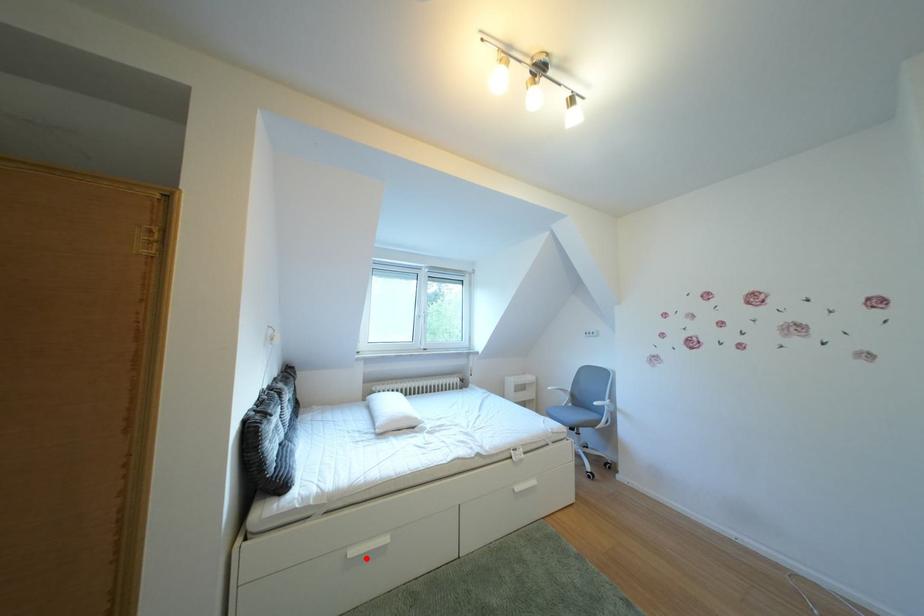
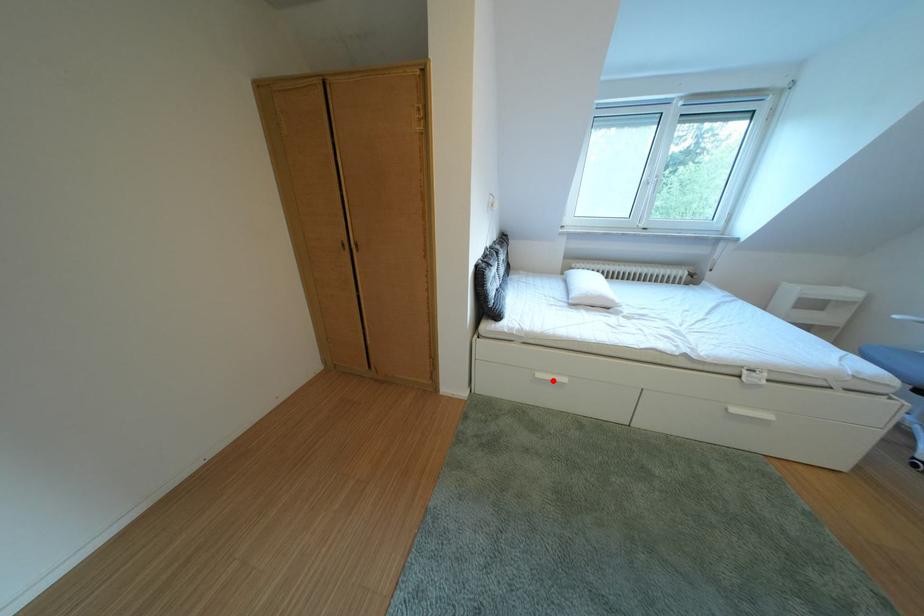
I am providing you with two images of the same scene from different viewpoints. A red point is marked on the first image and another point is marked on the second image. Is the red point in image1 aligned with the point shown in image2?

Yes